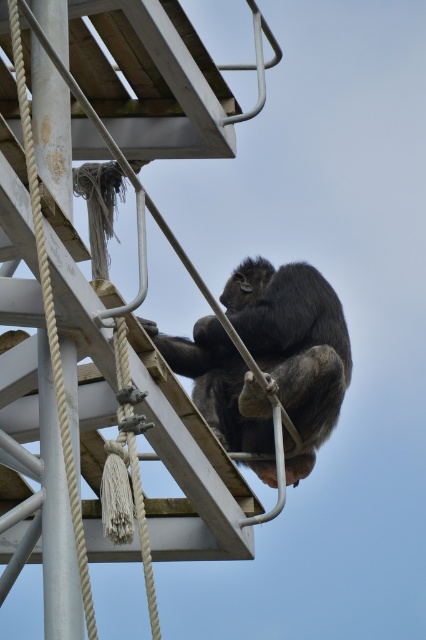
Which is behind, point (238, 268) or point (57, 353)?

The point (238, 268) is behind.

Does shiny black monkey at center appear under white rope at left?

Yes, shiny black monkey at center is below white rope at left.

In the scene shown: Who is more forward, (152,332) or (72,529)?

Positioned in front is point (72,529).

Identify the location of shiny black monkey at center. (293, 344).